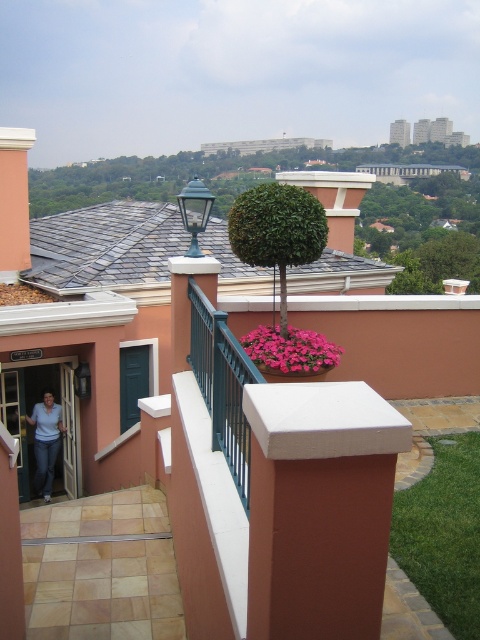
You are standing on the rooftop and want to reach the point marked at coordinates point (x=273, y=216). Considering the rooftop layout described, can you estimate how far you need to walk to get there?

The point (x=273, y=216) is 15.92 feet away from the viewer, so you need to walk approximately 15.92 feet to reach it.

You are standing on the rooftop and want to water the green leafy tree at center. If your watering can has a maximum reach of 5 meters, can you water it without moving closer?

The green leafy tree at center is 4.94 meters away from viewer, so yes, you can water it without moving closer since the distance is within the watering can reach.

You are designing a rooftop garden and need to place both the green leafy tree at center and the pink matte flower pot at center. Given their sizes, which object should you prioritize placing first to ensure they both fit on the rooftop?

The green leafy tree at center is bigger than the pink matte flower pot at center, so you should prioritize placing the green leafy tree at center first to ensure there is enough space for both.